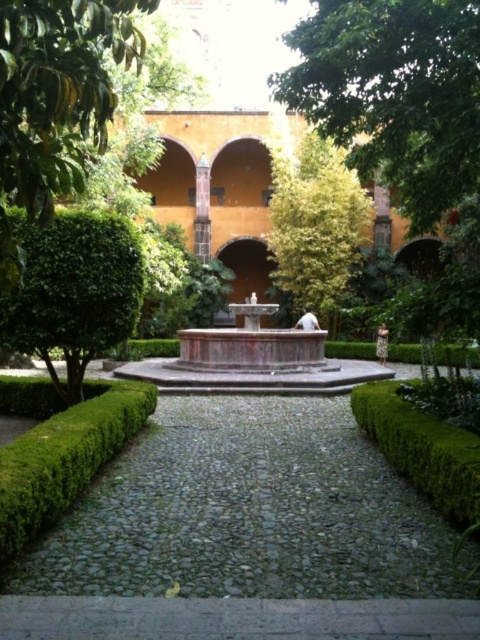
Between green leafy tree at center and green leafy hedge at lower right, which one has more height?

green leafy tree at center

Is green leafy tree at center taller than green leafy hedge at lower right?

Indeed, green leafy tree at center has a greater height compared to green leafy hedge at lower right.

This screenshot has height=640, width=480. What do you see at coordinates (312, 216) in the screenshot?
I see `green leafy tree at center` at bounding box center [312, 216].

Locate an element on the screen. The width and height of the screenshot is (480, 640). green leafy tree at center is located at coordinates (312, 216).

Is gray cobblestone path at center positioned at the back of green leafy bush at left?

No.

The height and width of the screenshot is (640, 480). I want to click on gray cobblestone path at center, so click(233, 618).

Image resolution: width=480 pixels, height=640 pixels. I want to click on gray cobblestone path at center, so click(x=233, y=618).

Can you confirm if gray cobblestone path at center is thinner than green leafy tree at center?

A: Correct, gray cobblestone path at center's width is less than green leafy tree at center's.

Does gray cobblestone path at center appear over green leafy tree at center?

No.

Who is more forward, [146,624] or [278,173]?

Point [146,624] is in front.

The height and width of the screenshot is (640, 480). I want to click on gray cobblestone path at center, so click(x=233, y=618).